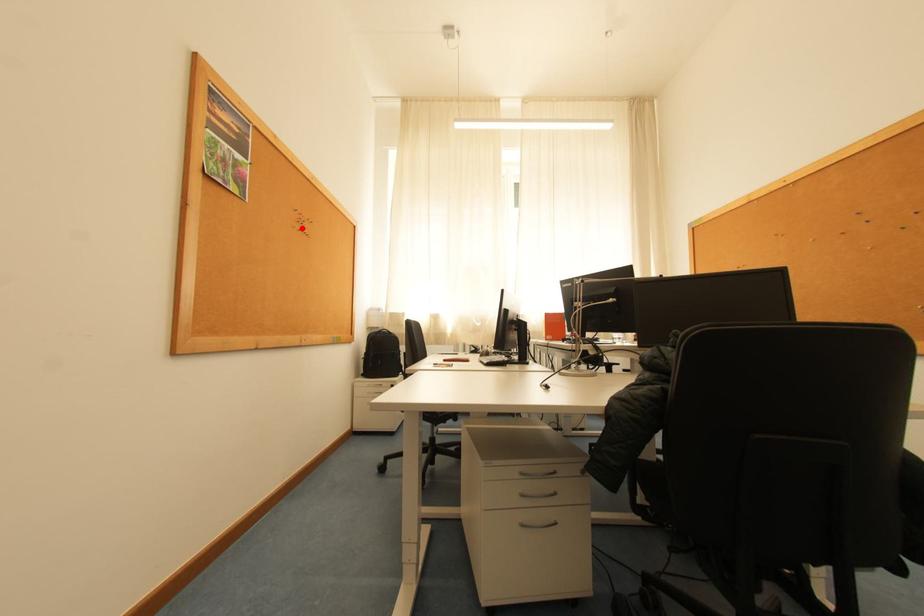
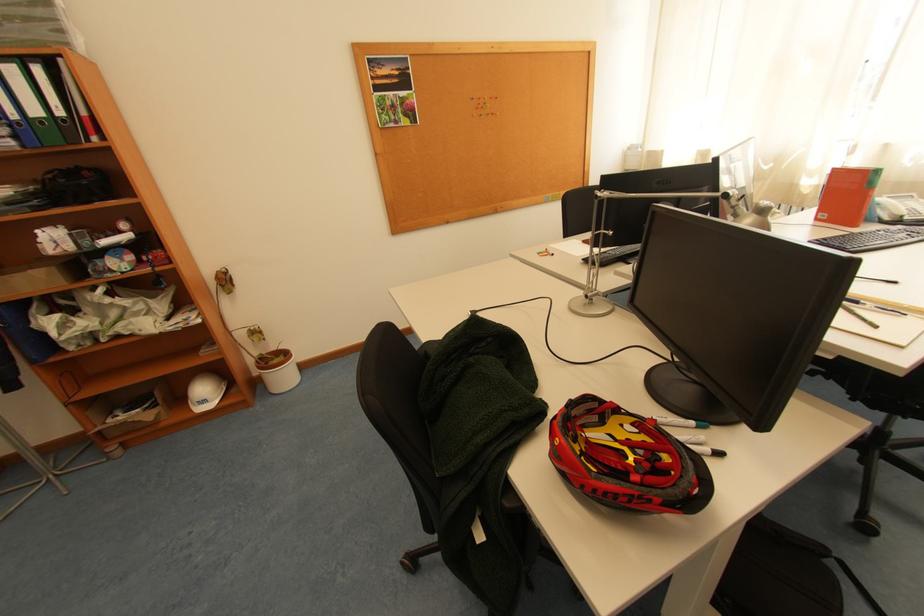
In the second image, find the point that corresponds to the highlighted location in the first image.

(481, 118)